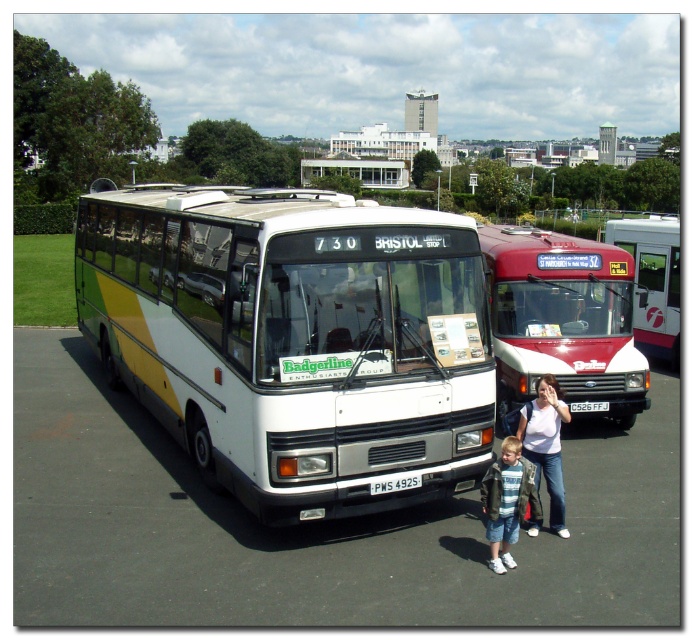
You are standing at the point with coordinates 0.75, 0.45 in the image. You want to walk to the white asphalt at center. In which direction should you move?

The white asphalt at center is located at point (312, 528). Since your current position is at (312, 480), you should move to the right to reach the white asphalt at center.

You are standing at the point with coordinates point (516, 492) and want to walk to the point with coordinates point (371, 392). Which direction should you move in?

You should move towards the front since point (371, 392) is behind point (516, 492).